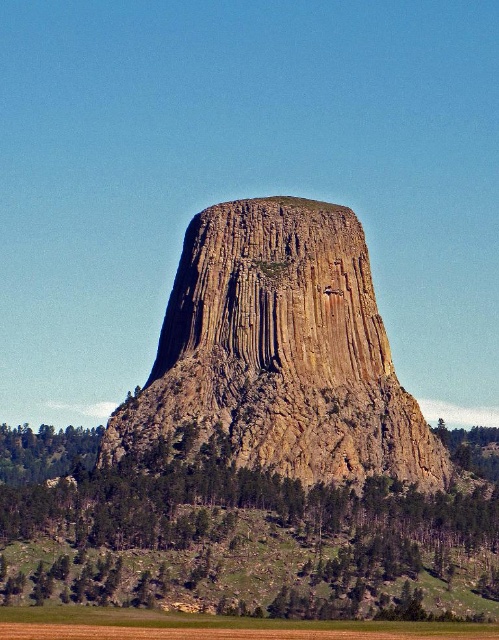
Question: Is yellowish-brown rock at center thinner than green leafy tree at lower left?

Choices:
 (A) no
 (B) yes

Answer: (A)

Question: Does green leafy trees at lower left appear on the right side of green leafy tree at lower left?

Choices:
 (A) yes
 (B) no

Answer: (A)

Question: Is green leafy trees at lower left to the right of green leafy tree at lower left from the viewer's perspective?

Choices:
 (A) no
 (B) yes

Answer: (B)

Question: Which point appears farthest from the camera in this image?

Choices:
 (A) (463, 449)
 (B) (407, 397)

Answer: (A)

Question: Which point is closer to the camera?

Choices:
 (A) yellowish-brown rock at center
 (B) green leafy tree at lower left

Answer: (A)

Question: Among these objects, which one is farthest from the camera?

Choices:
 (A) yellowish-brown rock at center
 (B) green leafy tree at lower right
 (C) green leafy tree at lower left

Answer: (B)